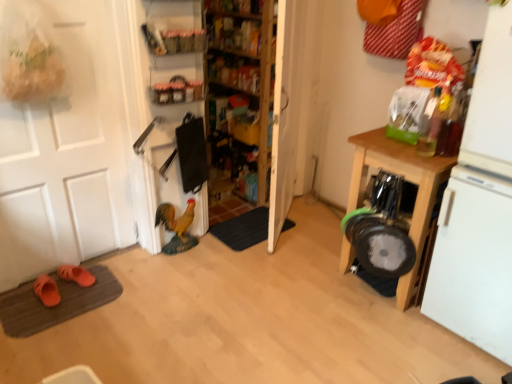
Image resolution: width=512 pixels, height=384 pixels. Find the location of `free location above white matte door at left (from a real-world perspective)`. free location above white matte door at left (from a real-world perspective) is located at coordinates (37, 0).